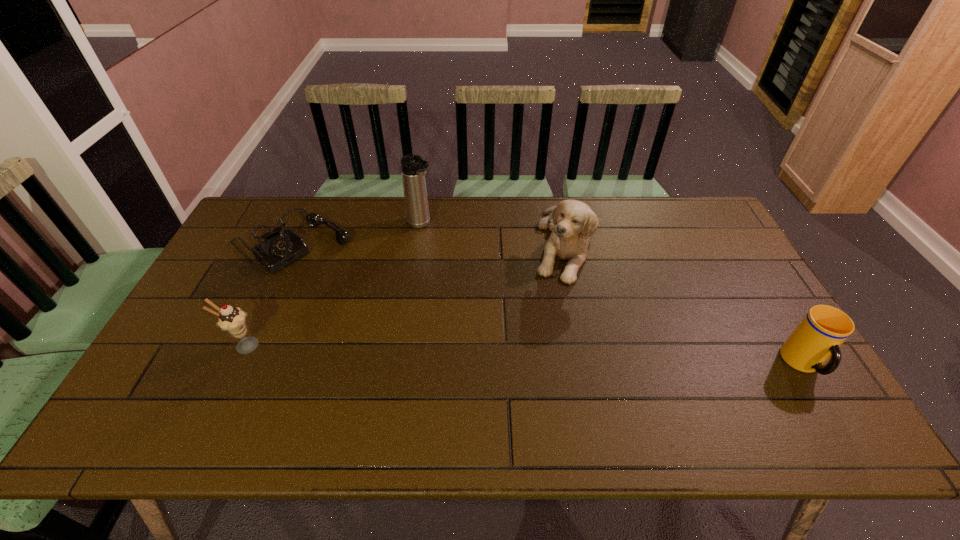
You are a GUI agent. You are given a task and a screenshot of the screen. Output one action in this format:
    pyautogui.click(x=<x>, y=<y>)
    Task: Click on the icecream
    
    Given the screenshot: What is the action you would take?
    pyautogui.click(x=232, y=320)

You are a GUI agent. You are given a task and a screenshot of the screen. Output one action in this format:
    pyautogui.click(x=<x>, y=<y>)
    Task: Click on the cup
    
    Given the screenshot: What is the action you would take?
    pyautogui.click(x=821, y=332)

This screenshot has width=960, height=540. In order to click on the rightmost object in this screenshot , I will do `click(821, 332)`.

Identify the location of the second object from right to left. (572, 223).

This screenshot has width=960, height=540. Identify the location of the third object from left to right. (413, 168).

Identify the location of the tallest object. This screenshot has width=960, height=540. (413, 168).

Locate an element on the screen. the shortest object is located at coordinates (279, 249).

In order to click on free space located on the right of the icecream in this screenshot , I will do `click(304, 346)`.

The image size is (960, 540). I want to click on free region located on the front-facing side of the second object from right to left, so click(x=565, y=362).

The width and height of the screenshot is (960, 540). I want to click on blank space located 0.140m on the front-facing side of the second object from right to left, so click(566, 322).